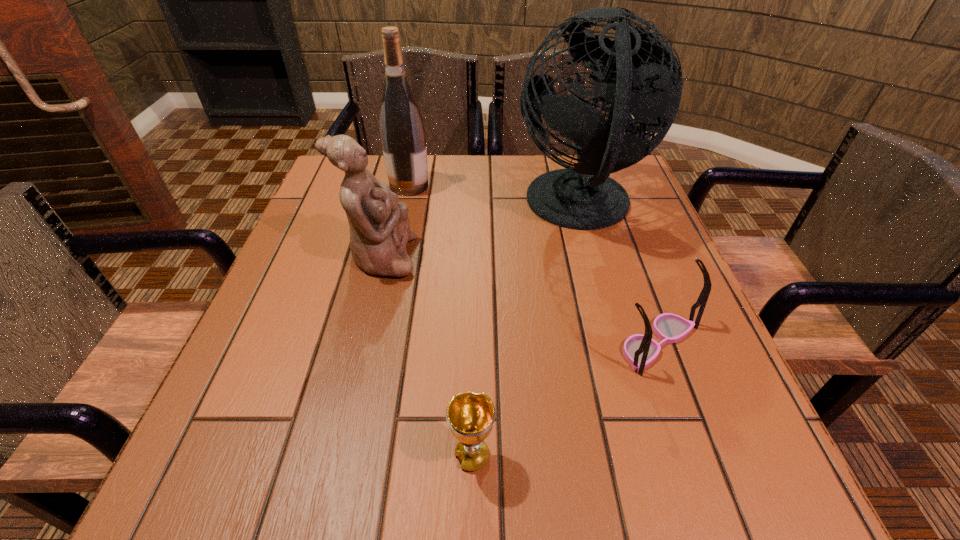
Identify the location of free location located on the front-facing side of the third tallest object. (529, 258).

Locate an element on the screen. This screenshot has height=540, width=960. free space located on the front of the fourth farthest object is located at coordinates (691, 435).

Where is `vacant area situated on the left of the third object from left to right`? vacant area situated on the left of the third object from left to right is located at coordinates (255, 456).

In order to click on globe that is at the far edge in this screenshot , I will do `click(633, 72)`.

Identify the location of wine bottle located in the far edge section of the desktop. (402, 131).

I want to click on object present at the near edge, so click(470, 416).

This screenshot has width=960, height=540. Find the location of `object present at the left edge`. object present at the left edge is located at coordinates (379, 226).

Locate an element on the screen. globe located in the right edge section of the desktop is located at coordinates (633, 72).

At what (x,y) coordinates should I click in order to perform the action: click on spectacles that is at the right edge. Please return your answer as a coordinate pair (x, y). This screenshot has height=540, width=960. Looking at the image, I should click on (640, 351).

Image resolution: width=960 pixels, height=540 pixels. I want to click on object located at the far right corner, so click(x=633, y=72).